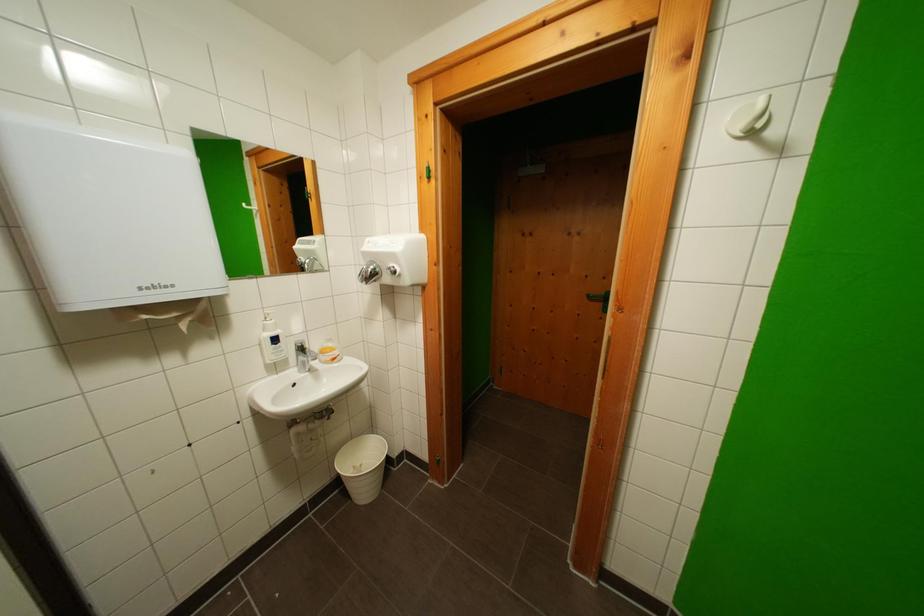
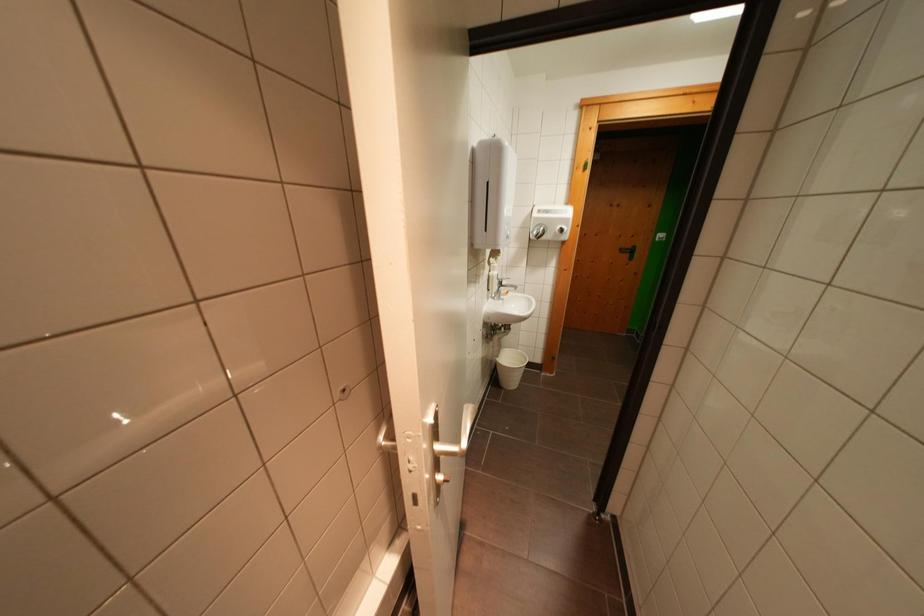
Question: What movement of the cameraman would produce the second image?

Choices:
 (A) Left
 (B) Right
 (C) Forward
 (D) Backward

Answer: (A)